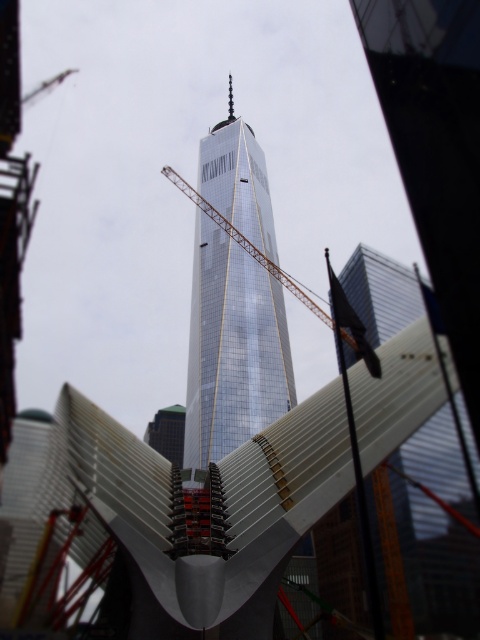
Does shiny glass skyscraper at center have a smaller size compared to metallic gold crane at center?

Actually, shiny glass skyscraper at center might be larger than metallic gold crane at center.

Is the position of shiny glass skyscraper at center less distant than that of metallic gold crane at center?

That is False.

Locate an element on the screen. The image size is (480, 640). shiny glass skyscraper at center is located at coordinates (232, 348).